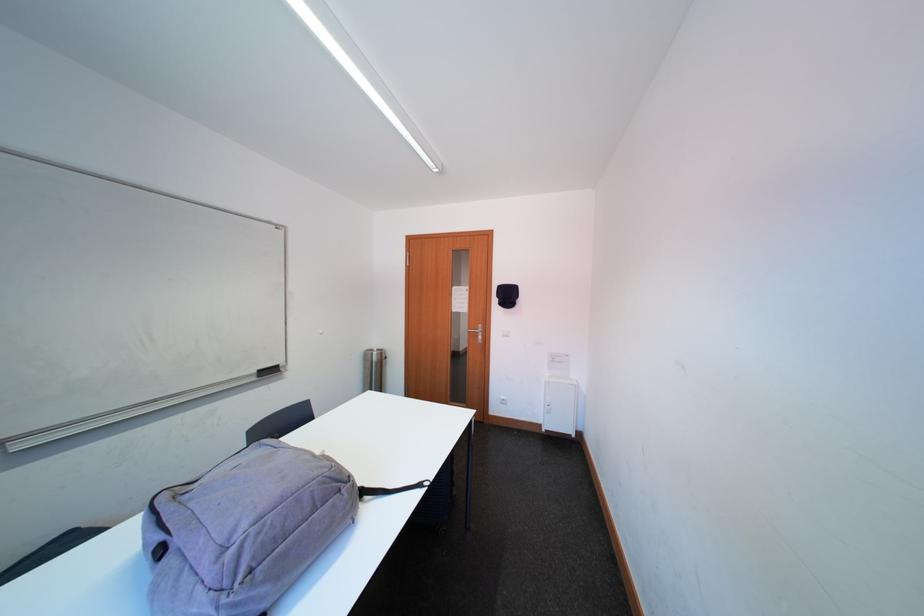
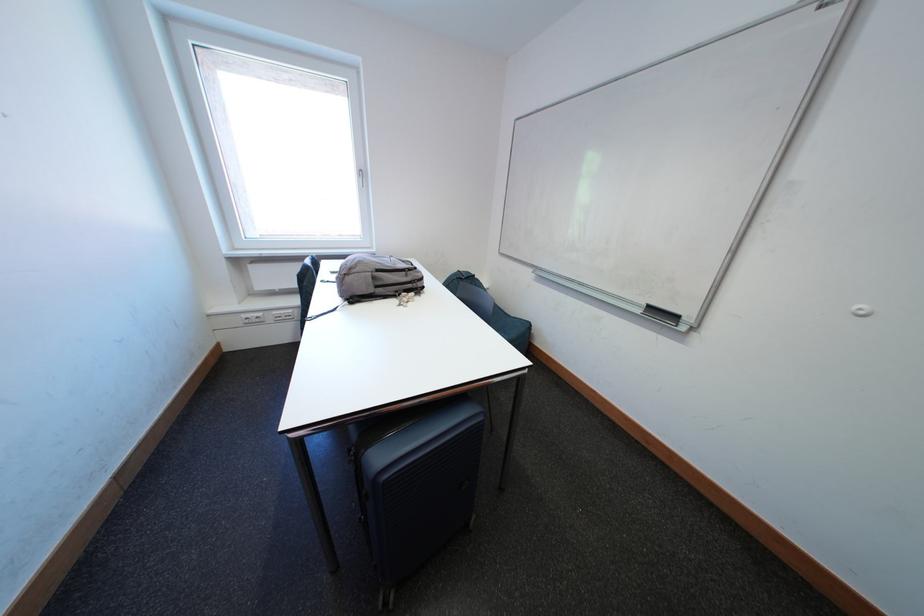
Locate, in the second image, the point that corresponds to (x=264, y=382) in the first image.

(649, 315)